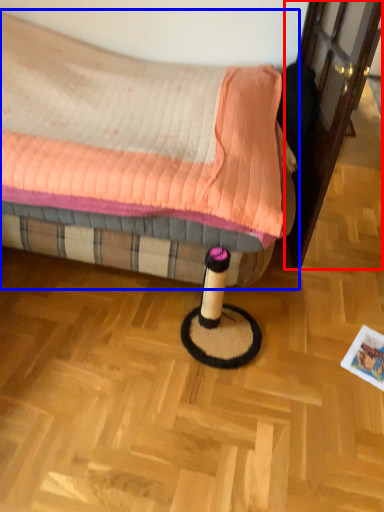
Question: Which object appears closest to the camera in this image, screen door (highlighted by a red box) or bed (highlighted by a blue box)?

Choices:
 (A) screen door
 (B) bed

Answer: (B)